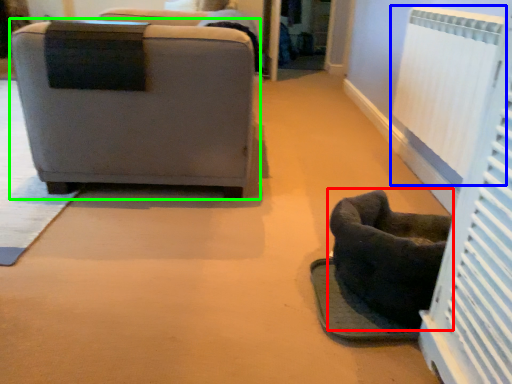
Question: Which object is positioned farthest from furniture (highlighted by a red box)? Select from radiator (highlighted by a blue box) and chair (highlighted by a green box).

Choices:
 (A) radiator
 (B) chair

Answer: (B)